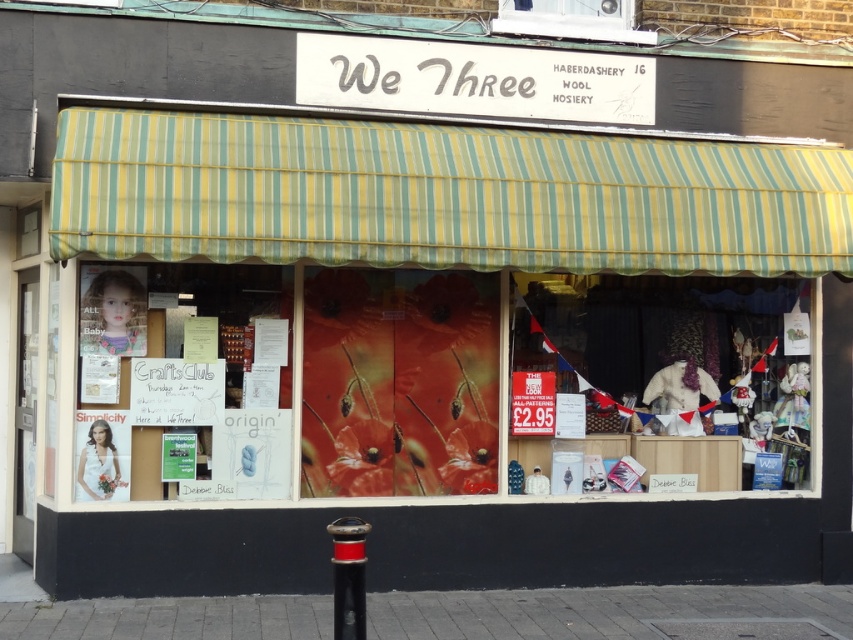
Question: Is the position of transparent plastic window at upper center more distant than that of black plastic pole at lower center?

Choices:
 (A) no
 (B) yes

Answer: (B)

Question: In this image, where is transparent plastic window at upper center located relative to black plastic pole at lower center?

Choices:
 (A) above
 (B) below

Answer: (A)

Question: Which of the following is the closest to the observer?

Choices:
 (A) [x=343, y=582]
 (B) [x=798, y=305]

Answer: (A)

Question: Which point is closer to the camera?

Choices:
 (A) (339, 520)
 (B) (660, 314)
 (C) (618, 8)

Answer: (A)

Question: Is matte white dress at center to the left of black plastic pole at lower center from the viewer's perspective?

Choices:
 (A) no
 (B) yes

Answer: (A)

Question: Which point is farther from the camera taking this photo?

Choices:
 (A) (636, 413)
 (B) (364, 621)
 (C) (544, 16)

Answer: (A)